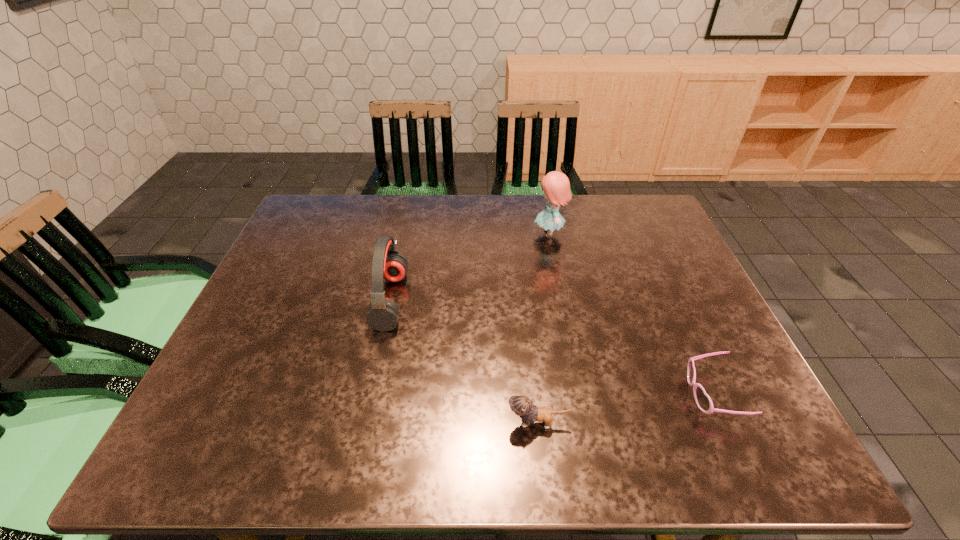
Find the location of a particular element. object present at the near right corner is located at coordinates (703, 401).

In the image, there is a desktop. Identify the location of vacant space at the far edge. (417, 197).

In the image, there is a desktop. Identify the location of vacant area at the left edge. Image resolution: width=960 pixels, height=540 pixels. (223, 379).

Identify the location of free region at the right edge of the desktop. (679, 338).

Image resolution: width=960 pixels, height=540 pixels. What are the coordinates of `free space at the far left corner of the desktop` in the screenshot? It's located at (300, 232).

What are the coordinates of `free spot between the rightmost object and the third tallest object` in the screenshot? It's located at (625, 409).

Image resolution: width=960 pixels, height=540 pixels. I want to click on empty location between the third nearest object and the farthest object, so click(x=470, y=267).

Where is `vacant space in between the third tallest object and the leftmost object`? The width and height of the screenshot is (960, 540). vacant space in between the third tallest object and the leftmost object is located at coordinates (464, 362).

Identify the location of vacant area between the sunglasses and the leftmost object. This screenshot has width=960, height=540. (551, 347).

Identify the location of free space between the second farthest object and the doll. This screenshot has height=540, width=960. (470, 267).